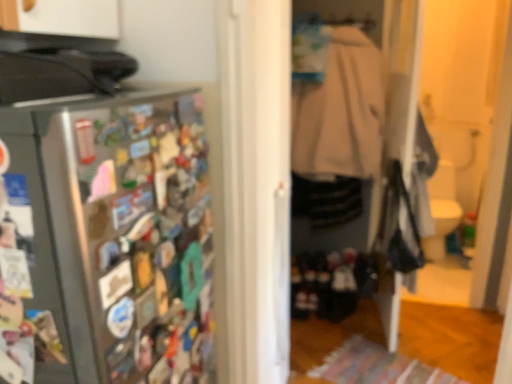
Question: Is beige fabric coat at center smaller than satin silver refrigerator at left?

Choices:
 (A) no
 (B) yes

Answer: (B)

Question: Does beige fabric coat at center lie behind satin silver refrigerator at left?

Choices:
 (A) yes
 (B) no

Answer: (A)

Question: Can you confirm if beige fabric coat at center is bigger than satin silver refrigerator at left?

Choices:
 (A) no
 (B) yes

Answer: (A)

Question: Is beige fabric coat at center outside of satin silver refrigerator at left?

Choices:
 (A) yes
 (B) no

Answer: (A)

Question: Considering the relative positions of beige fabric coat at center and satin silver refrigerator at left in the image provided, is beige fabric coat at center to the left of satin silver refrigerator at left from the viewer's perspective?

Choices:
 (A) no
 (B) yes

Answer: (A)

Question: From a real-world perspective, does beige fabric coat at center stand above satin silver refrigerator at left?

Choices:
 (A) yes
 (B) no

Answer: (A)

Question: Is satin silver refrigerator at left positioned in front of beige fabric coat at center?

Choices:
 (A) no
 (B) yes

Answer: (B)

Question: Considering the relative sizes of satin silver refrigerator at left and beige fabric coat at center in the image provided, is satin silver refrigerator at left shorter than beige fabric coat at center?

Choices:
 (A) no
 (B) yes

Answer: (B)

Question: Is satin silver refrigerator at left to the left of beige fabric coat at center from the viewer's perspective?

Choices:
 (A) yes
 (B) no

Answer: (A)

Question: Considering the relative sizes of satin silver refrigerator at left and beige fabric coat at center in the image provided, is satin silver refrigerator at left bigger than beige fabric coat at center?

Choices:
 (A) yes
 (B) no

Answer: (A)

Question: Is satin silver refrigerator at left facing towards beige fabric coat at center?

Choices:
 (A) yes
 (B) no

Answer: (B)

Question: Is satin silver refrigerator at left far from beige fabric coat at center?

Choices:
 (A) no
 (B) yes

Answer: (B)

Question: Is point (306, 92) positioned closer to the camera than point (4, 173)?

Choices:
 (A) farther
 (B) closer

Answer: (A)